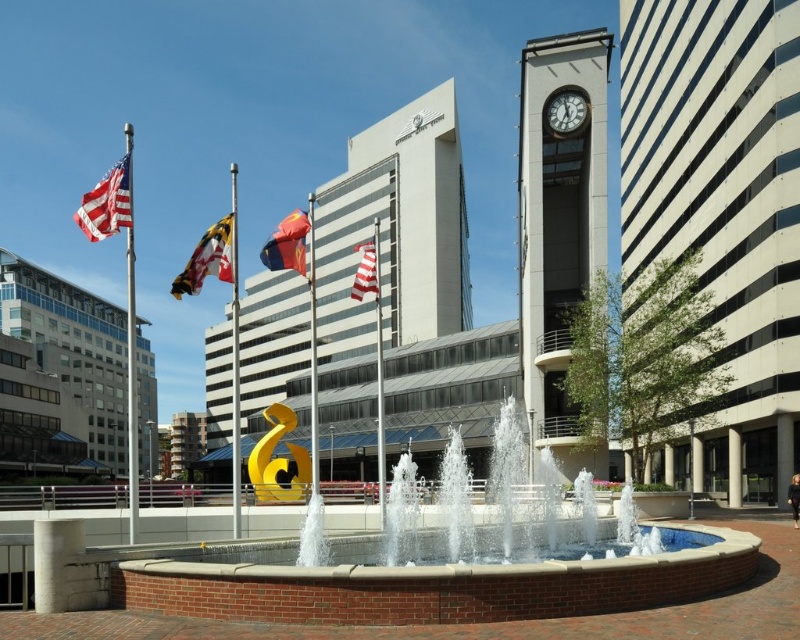
Question: Is white glass clock tower at upper right to the right of white glossy clock at upper center from the viewer's perspective?

Choices:
 (A) yes
 (B) no

Answer: (A)

Question: From the image, what is the correct spatial relationship of white and blue striped flag at center in relation to white glossy clock at upper center?

Choices:
 (A) left
 (B) right

Answer: (A)

Question: Which of the following is the farthest from the observer?

Choices:
 (A) american flag at left
 (B) white glossy clock at upper center
 (C) red fabric flag at center

Answer: (B)

Question: Which object is closer to the camera taking this photo?

Choices:
 (A) white glass clock tower at upper right
 (B) red fabric flag at center
 (C) brick fountain at center
 (D) white glossy clock at upper center

Answer: (C)

Question: Is white striped tower at right to the left of brick fountain at center from the viewer's perspective?

Choices:
 (A) yes
 (B) no

Answer: (B)

Question: Which of the following is the farthest from the observer?

Choices:
 (A) red fabric flag at center
 (B) white and blue striped flag at center

Answer: (A)